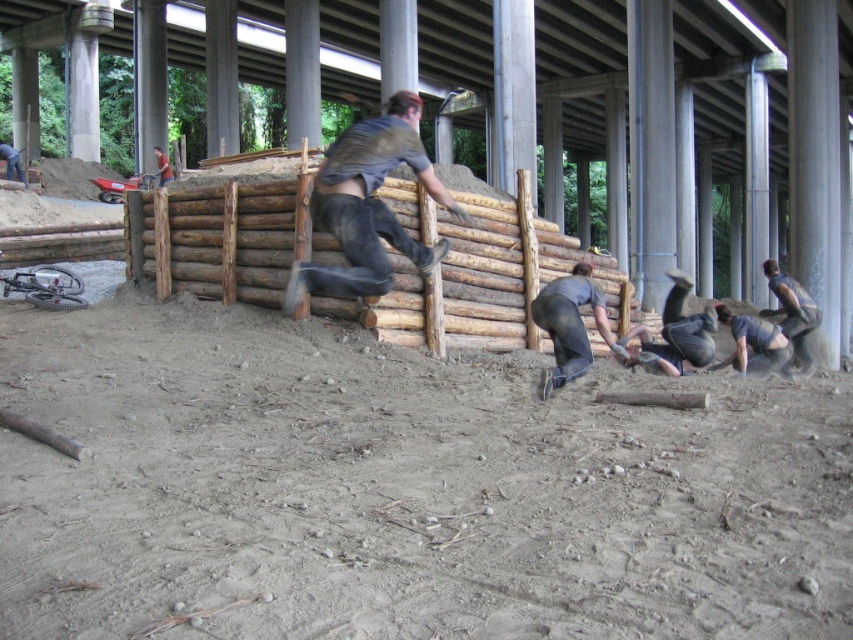
Question: Which point is closer to the camera?

Choices:
 (A) dark gray fabric pants at lower center
 (B) dark gray fabric pants at lower right
 (C) brown leather boots at center

Answer: (C)

Question: Does brown leather boots at center have a smaller size compared to dark gray jeans at lower center?

Choices:
 (A) no
 (B) yes

Answer: (B)

Question: Is dark gray fabric worker at lower right smaller than dark gray fabric pants at lower right?

Choices:
 (A) yes
 (B) no

Answer: (A)

Question: Among these objects, which one is nearest to the camera?

Choices:
 (A) dark gray jeans at lower center
 (B) dark gray fabric pants at lower right
 (C) dark gray fabric pants at lower center

Answer: (A)

Question: Which point appears closest to the camera in this image?

Choices:
 (A) (722, 307)
 (B) (683, 285)
 (C) (544, 387)

Answer: (C)

Question: Can you confirm if dark gray jeans at lower center is thinner than dark gray fabric pants at lower center?

Choices:
 (A) yes
 (B) no

Answer: (B)